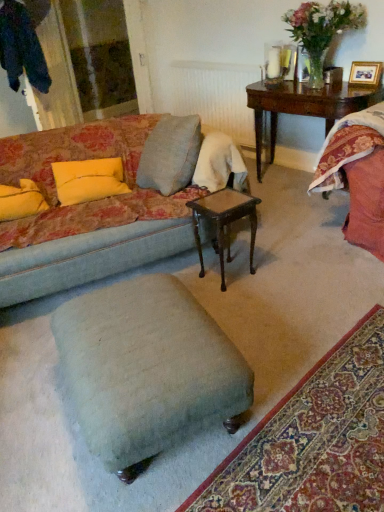
Locate an element on the screen. This screenshot has height=512, width=384. vacant area on top of wooden stained table at center (from a real-world perspective) is located at coordinates (225, 199).